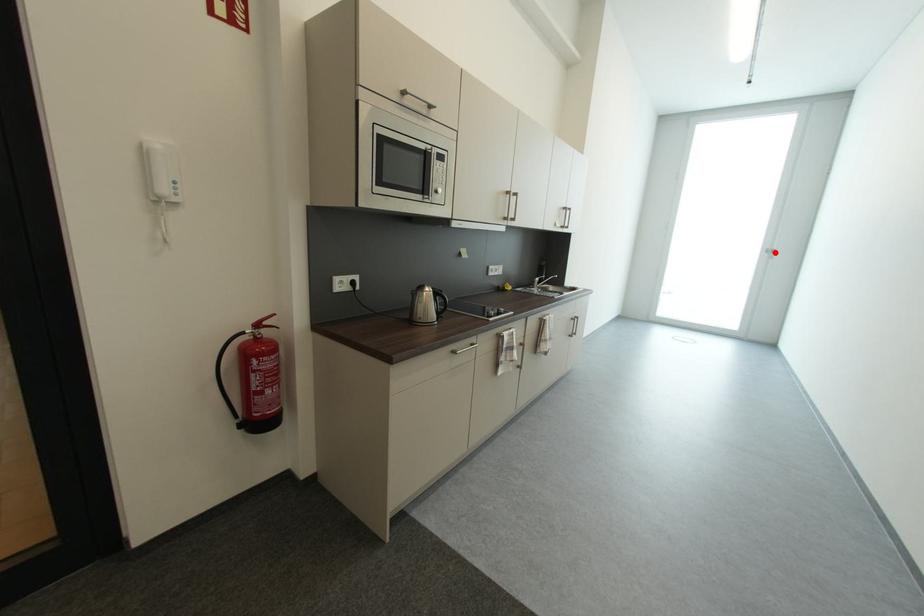
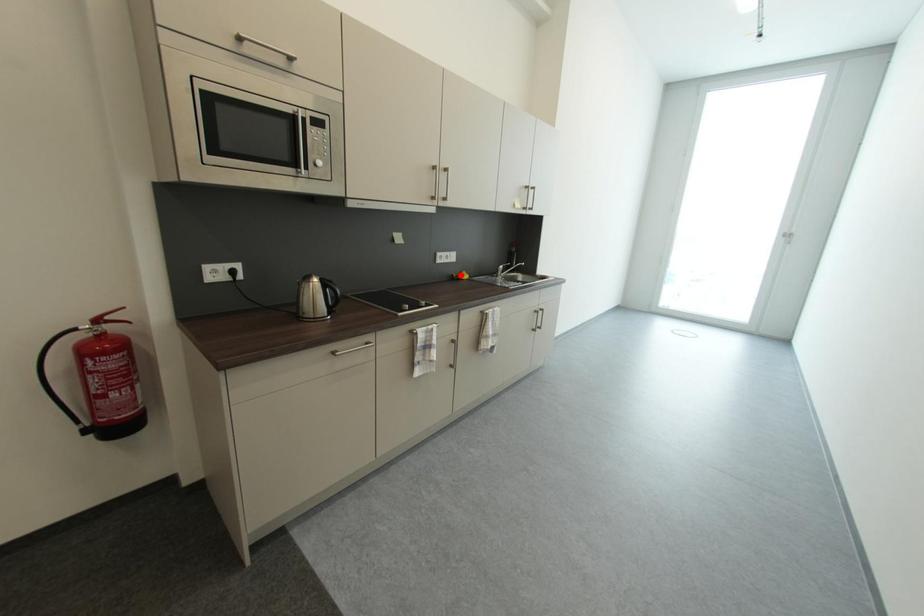
I am providing you with two images of the same scene from different viewpoints. A red point is marked on the first image and another point is marked on the second image. Are the points marked in image1 and image2 representing the same 3D position?

No